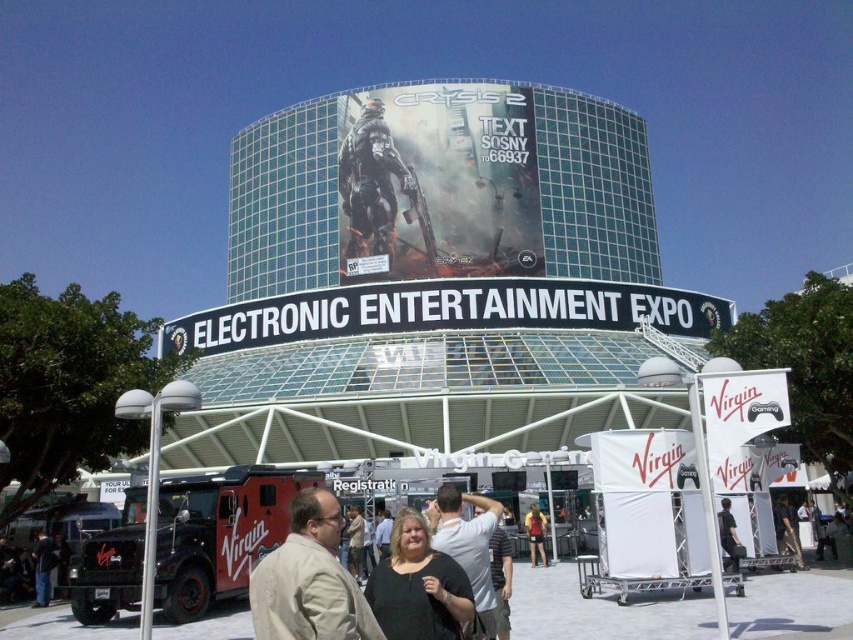
You are attending E3 and want to take a photo of the Crysis 2 advertisement on the building facade. However, there is a black matte shirt at center in the way. Based on the coordinates provided, can you estimate if the shirt will block your view of the advertisement?

The black matte shirt at center is located at coordinates point (418,586). Since the Crysis 2 advertisement is on the facade of the curved glass building, which is the focal point, the shirt positioned at the center might block your view depending on your angle and distance. However, without additional spatial details like the shirt size or your position relative to the building, it is difficult to determine precisely.